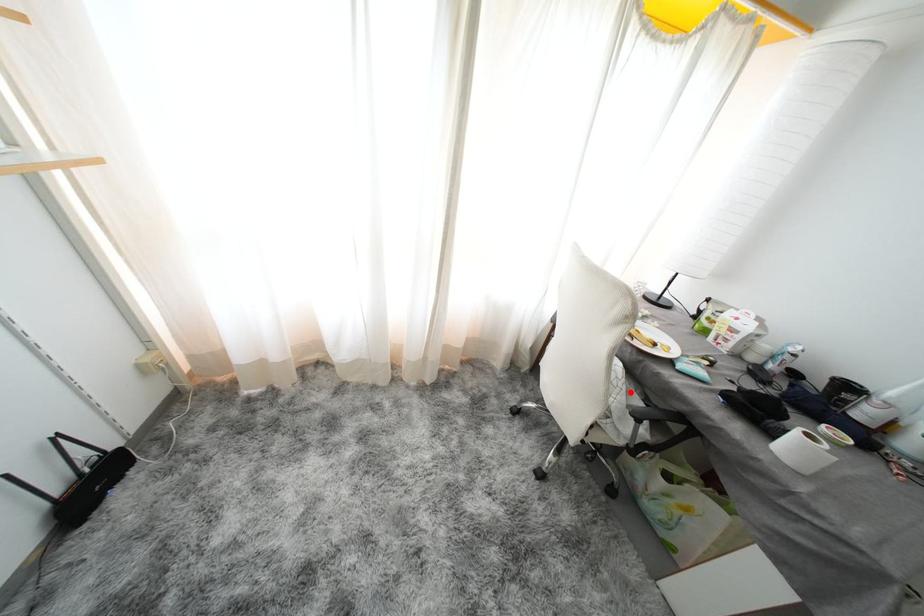
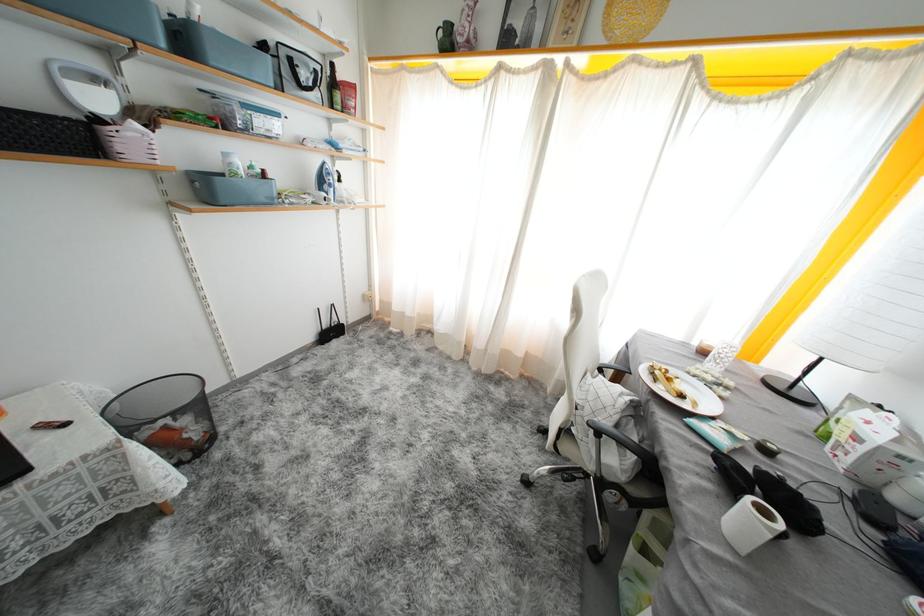
Question: I am providing you with two images of the same scene from different viewpoints. Given a red point in image1, look at the same physical point in image2. Is it:

Choices:
 (A) Closer to the viewpoint
 (B) Farther from the viewpoint

Answer: (A)